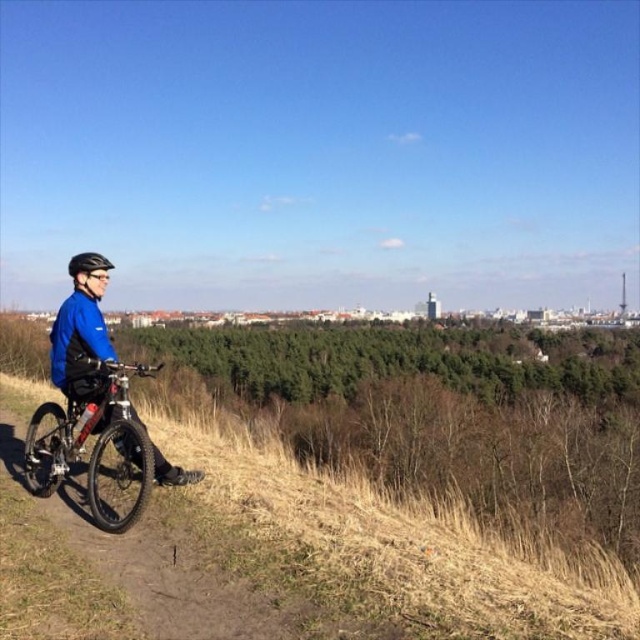
Who is more distant from viewer, (51, 458) or (93, 253)?

Point (51, 458)

Which is behind, point (38, 490) or point (109, 262)?

Point (38, 490)

The image size is (640, 640). What are the coordinates of `shiny metallic bicycle at lower left` in the screenshot? It's located at (93, 444).